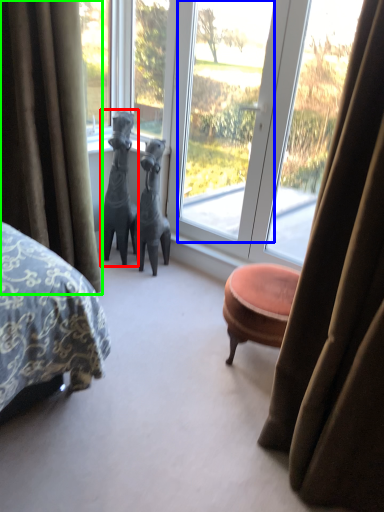
Question: Considering the real-world distances, which object is closest to animal (highlighted by a red box)? window screen (highlighted by a blue box) or curtain (highlighted by a green box).

Choices:
 (A) window screen
 (B) curtain

Answer: (A)